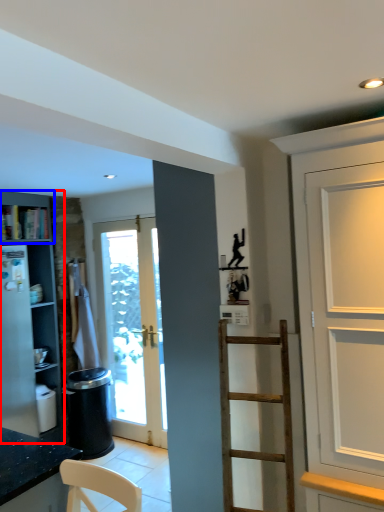
Question: Which of the following is the farthest to the observer, cabinetry (highlighted by a red box) or cabinet (highlighted by a blue box)?

Choices:
 (A) cabinetry
 (B) cabinet

Answer: (B)